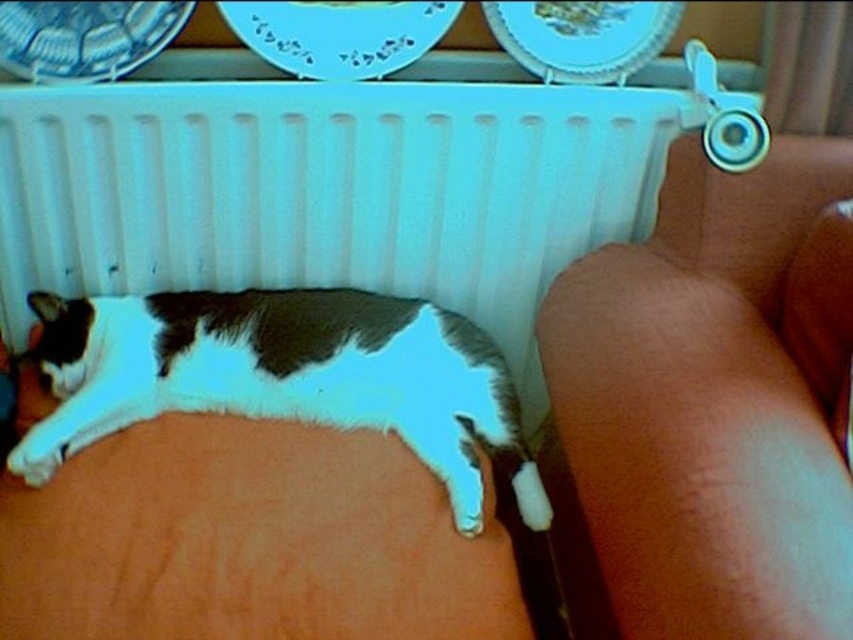
Question: Which of the following is the farthest from the observer?

Choices:
 (A) white plastic radiator at upper center
 (B) brown leather couch at lower right

Answer: (A)

Question: Which of the following is the farthest from the observer?

Choices:
 (A) brown leather couch at lower right
 (B) white fur cat at lower left

Answer: (B)

Question: Does brown leather couch at lower right have a larger size compared to white fur cat at lower left?

Choices:
 (A) yes
 (B) no

Answer: (A)

Question: From the image, what is the correct spatial relationship of white plastic radiator at upper center in relation to white fur cat at lower left?

Choices:
 (A) right
 (B) left

Answer: (A)

Question: Can you confirm if brown leather couch at lower right is positioned above white fur cat at lower left?

Choices:
 (A) no
 (B) yes

Answer: (B)

Question: Which object appears farthest from the camera in this image?

Choices:
 (A) white plastic radiator at upper center
 (B) brown leather couch at lower right

Answer: (A)